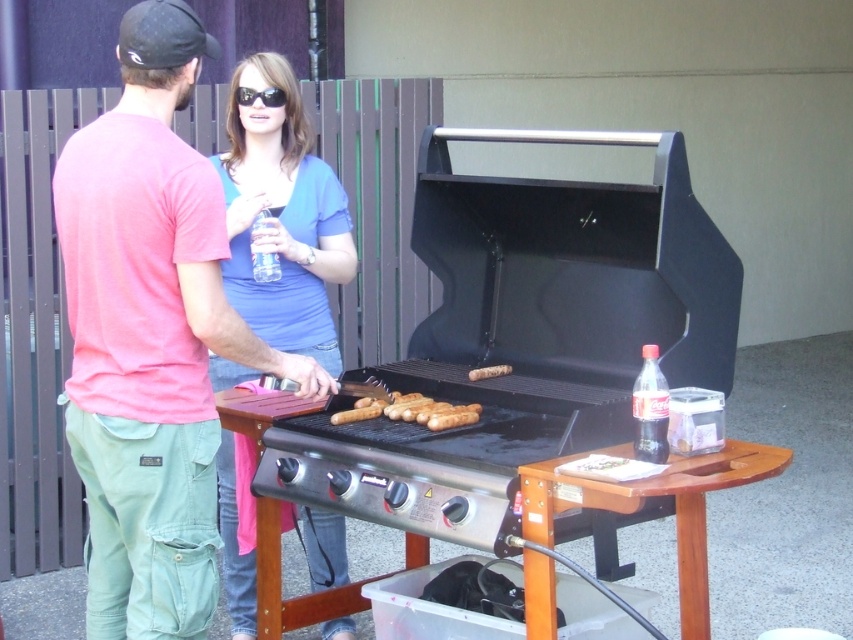
Question: Can you confirm if black matte grill at center is thinner than smooth brown hot dogs at center?

Choices:
 (A) no
 (B) yes

Answer: (A)

Question: Which of the following is the closest to the observer?

Choices:
 (A) coord(485,369)
 (B) coord(196,518)

Answer: (B)

Question: Which object is the closest to the smooth brown hot dogs at center?

Choices:
 (A) black fabric baseball cap at upper left
 (B) clear plastic bottle at center
 (C) matte pink t-shirt at center
 (D) clear plastic bottle at right

Answer: (C)

Question: Estimate the real-world distances between objects in this image. Which object is farther from the blue cotton shirt at upper center?

Choices:
 (A) clear plastic bottle at right
 (B) black plastic sunglasses at center

Answer: (A)

Question: Does black matte grill at center have a smaller size compared to black fabric baseball cap at upper left?

Choices:
 (A) yes
 (B) no

Answer: (B)

Question: Where is blue cotton shirt at upper center located in relation to black plastic sunglasses at center in the image?

Choices:
 (A) below
 (B) above

Answer: (A)